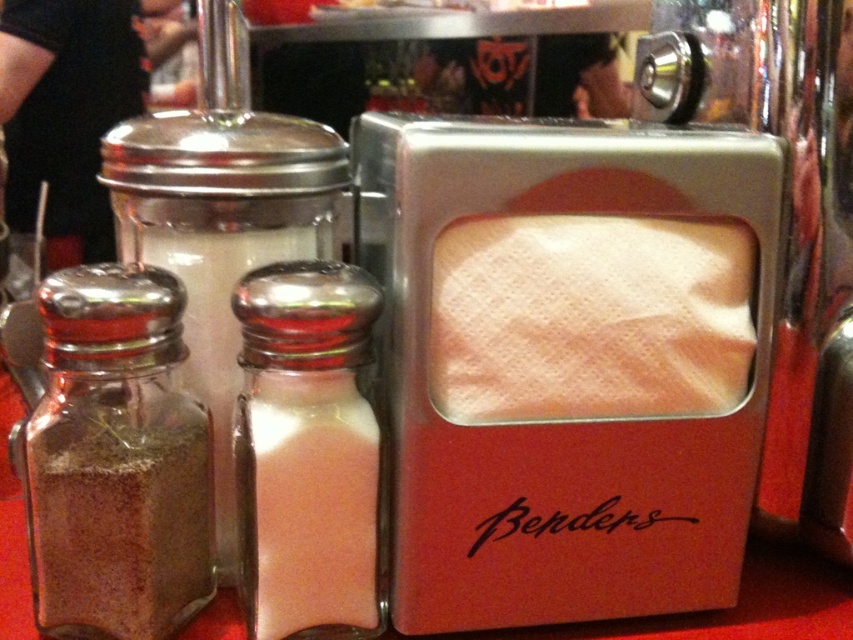
Question: Which object appears farthest from the camera in this image?

Choices:
 (A) white paper napkin at center
 (B) pink glass salt shaker at center

Answer: (A)

Question: Which point is farther to the camera?

Choices:
 (A) pink glass salt shaker at center
 (B) white paper napkin at center
 (C) brown powder at left

Answer: (B)

Question: Can you confirm if brown powder at left is bigger than pink glass salt shaker at center?

Choices:
 (A) yes
 (B) no

Answer: (A)

Question: Among these objects, which one is nearest to the camera?

Choices:
 (A) brown powder at left
 (B) white paper napkin at center
 (C) pink glass salt shaker at center

Answer: (A)

Question: Is brown powder at left behind pink glass salt shaker at center?

Choices:
 (A) yes
 (B) no

Answer: (B)

Question: Can you confirm if white paper napkin at center is smaller than pink glass salt shaker at center?

Choices:
 (A) no
 (B) yes

Answer: (B)